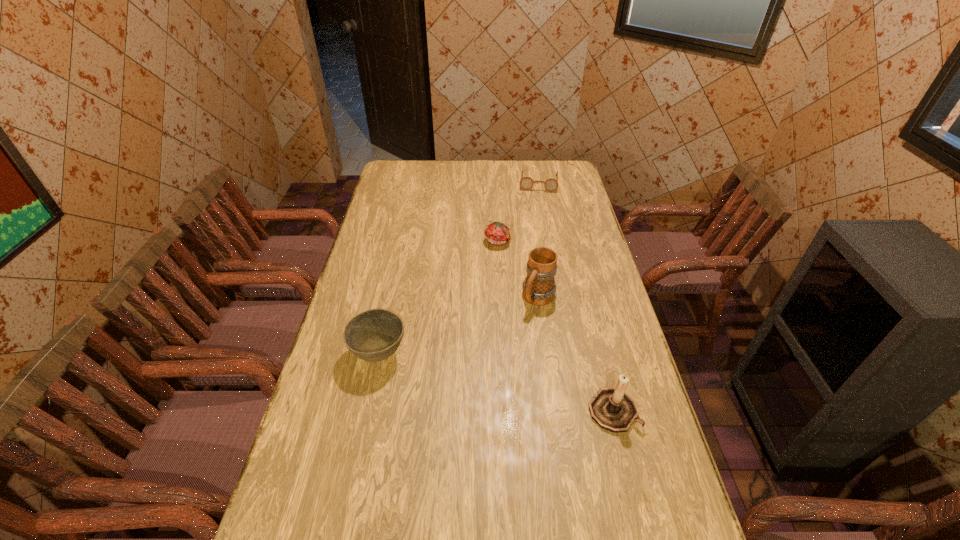
Where is `free space between the candle holder and the fourth farthest object`? Image resolution: width=960 pixels, height=540 pixels. free space between the candle holder and the fourth farthest object is located at coordinates (496, 383).

Locate an element on the screen. The width and height of the screenshot is (960, 540). empty location between the shortest object and the second farthest object is located at coordinates (518, 212).

At what (x,y) coordinates should I click in order to perform the action: click on empty location between the spectacles and the mug. Please return your answer as a coordinate pair (x, y). Looking at the image, I should click on (539, 240).

The height and width of the screenshot is (540, 960). Identify the location of free spot between the leftmost object and the spectacles. (459, 268).

This screenshot has width=960, height=540. Identify the location of free space between the fourth tallest object and the third farthest object. (518, 270).

In order to click on free spot between the candle holder and the second shortest object in this screenshot , I will do `click(556, 326)`.

This screenshot has height=540, width=960. In order to click on free space that is in between the shortest object and the second object from left to right in this screenshot , I will do `click(518, 212)`.

Where is `free space between the third tallest object and the shortest object`? free space between the third tallest object and the shortest object is located at coordinates (459, 268).

Find the location of `vacant space in between the mug and the second farthest object`. vacant space in between the mug and the second farthest object is located at coordinates (518, 270).

Identify the location of free area in between the leftmost object and the mug. The height and width of the screenshot is (540, 960). (459, 326).